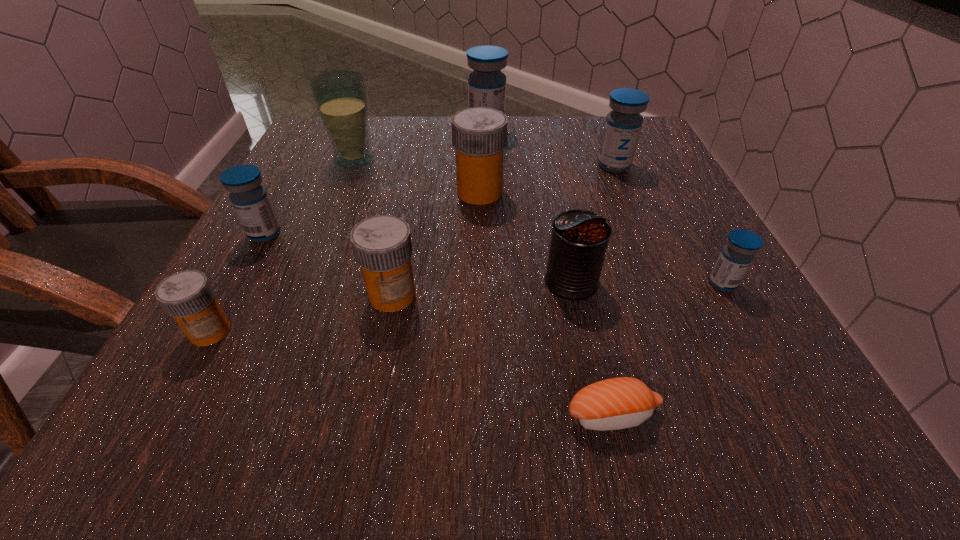
Where is `free space between the can and the farthest orange medicine`? The width and height of the screenshot is (960, 540). free space between the can and the farthest orange medicine is located at coordinates (525, 237).

I want to click on vacant space that is in between the nearest orange medicine and the rightmost blue medicine, so click(467, 307).

The width and height of the screenshot is (960, 540). Identify the location of vacant space that's between the eighth object from right to left and the farthest object. (420, 146).

This screenshot has width=960, height=540. Identify the location of vacant area that lies between the shortest object and the can. (592, 348).

Identify the location of free point between the third blue medicine from right to left and the can. The image size is (960, 540). (529, 207).

Where is `empty location between the nearest medicine and the farthest blue medicine`? Image resolution: width=960 pixels, height=540 pixels. empty location between the nearest medicine and the farthest blue medicine is located at coordinates (348, 232).

You are a GUI agent. You are given a task and a screenshot of the screen. Output one action in this format:
    pyautogui.click(x=<x>, y=<y>)
    Task: Click on the free area in between the third object from left to right and the fifth farthest object
    Image resolution: width=960 pixels, height=540 pixels.
    Given the screenshot: What is the action you would take?
    pyautogui.click(x=309, y=197)

Find the location of a particular element. vacant point located between the nearest orange medicine and the farthest object is located at coordinates (348, 232).

Identify which object is the fourth closest to the glass. Please provide its 2D coordinates. Your answer should be formatted as a tuple, i.e. [(x, y)], where the tuple contains the x and y coordinates of a point satisfying the conditions above.

[(382, 246)]

Select which object is the ninth closest to the can. Please provide its 2D coordinates. Your answer should be formatted as a tuple, i.e. [(x, y)], where the tuple contains the x and y coordinates of a point satisfying the conditions above.

[(250, 200)]